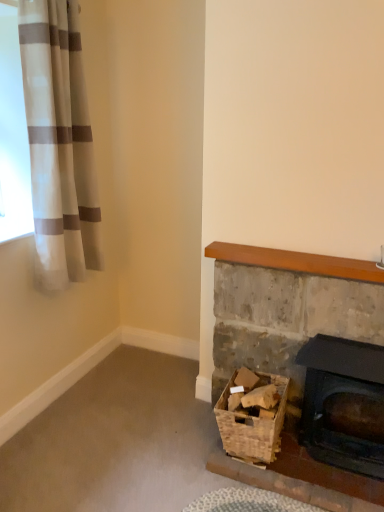
Image resolution: width=384 pixels, height=512 pixels. I want to click on free space in front of matte black fireplace at lower right, which ranks as the 2th fireplace in left-to-right order, so click(336, 488).